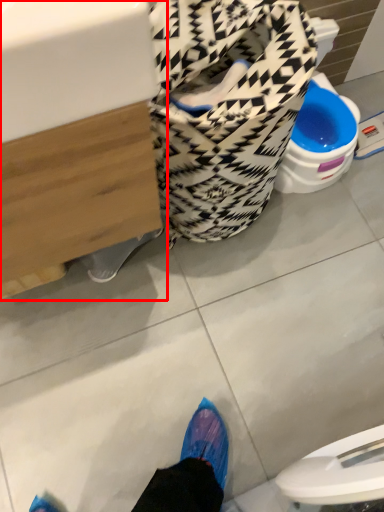
Question: From the image's perspective, considering the relative positions of sink (annotated by the red box) and laundry basket in the image provided, where is sink (annotated by the red box) located with respect to the staircase?

Choices:
 (A) above
 (B) below

Answer: (B)